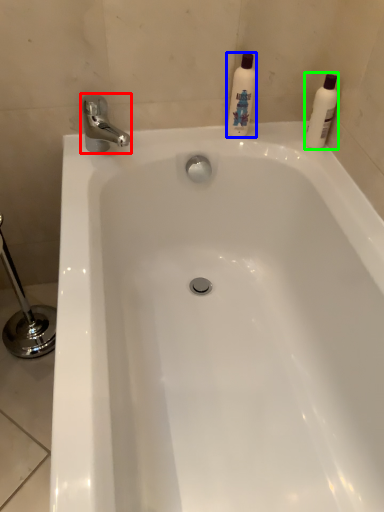
Question: Which object is the farthest from tap (highlighted by a red box)? Choose among these: cleaning product (highlighted by a blue box) or cleaning product (highlighted by a green box).

Choices:
 (A) cleaning product
 (B) cleaning product

Answer: (B)